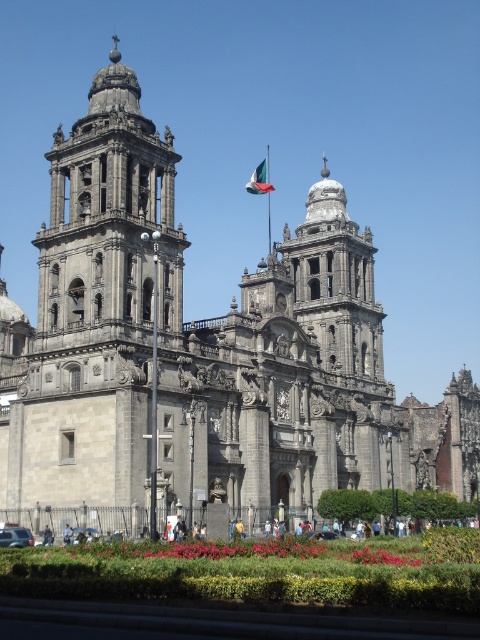
Question: Which object appears farthest from the camera in this image?

Choices:
 (A) gray stone tower at upper left
 (B) green fabric flag at center

Answer: (B)

Question: Is gray stone tower at upper left to the right of green fabric flag at center from the viewer's perspective?

Choices:
 (A) no
 (B) yes

Answer: (A)

Question: Is gray stone tower at upper left to the right of green fabric flag at center from the viewer's perspective?

Choices:
 (A) yes
 (B) no

Answer: (B)

Question: Can you confirm if gray stone tower at upper left is bigger than green fabric flag at center?

Choices:
 (A) no
 (B) yes

Answer: (B)

Question: Which object appears farthest from the camera in this image?

Choices:
 (A) green fabric flag at center
 (B) gray stone tower at upper left

Answer: (A)